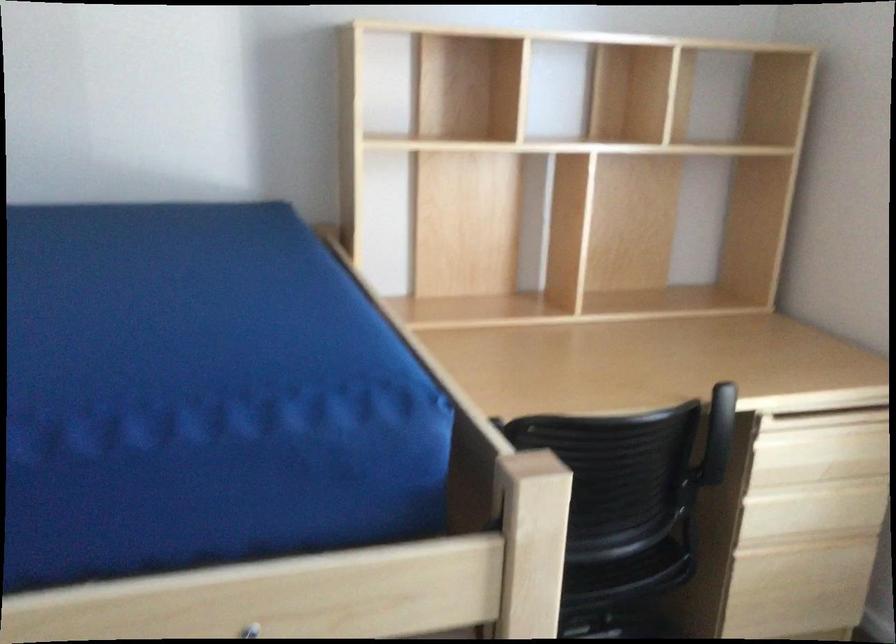
What do you see at coordinates (716, 438) in the screenshot? The height and width of the screenshot is (644, 896). I see `a black chair armrest` at bounding box center [716, 438].